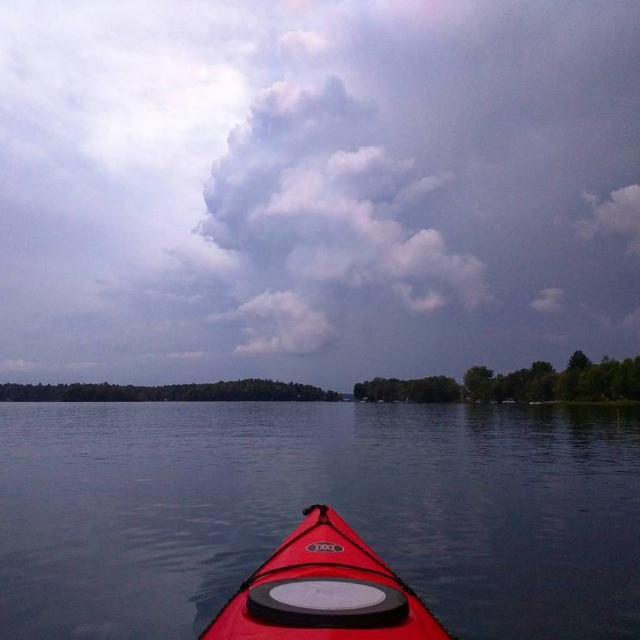
Does cloudy sky at upper center come behind transparent water at center?

Yes.

Can you confirm if cloudy sky at upper center is thinner than transparent water at center?

Incorrect, cloudy sky at upper center's width is not less than transparent water at center's.

Is point (564, 152) closer to viewer compared to point (403, 465)?

No, it is not.

This screenshot has height=640, width=640. What are the coordinates of `cloudy sky at upper center` in the screenshot? It's located at (316, 186).

Is cloudy sky at upper center positioned before matte red kayak at center?

No, it is not.

What do you see at coordinates (316, 186) in the screenshot? I see `cloudy sky at upper center` at bounding box center [316, 186].

At what (x,y) coordinates should I click in order to perform the action: click on cloudy sky at upper center. Please return your answer as a coordinate pair (x, y). Image resolution: width=640 pixels, height=640 pixels. Looking at the image, I should click on [x=316, y=186].

Between transparent water at center and matte red kayak at center, which one appears on the right side from the viewer's perspective?

matte red kayak at center is more to the right.

Is transparent water at center further to the viewer compared to matte red kayak at center?

That is True.

At what (x,y) coordinates should I click in order to perform the action: click on transparent water at center. Please return your answer as a coordinate pair (x, y). The width and height of the screenshot is (640, 640). Looking at the image, I should click on (316, 500).